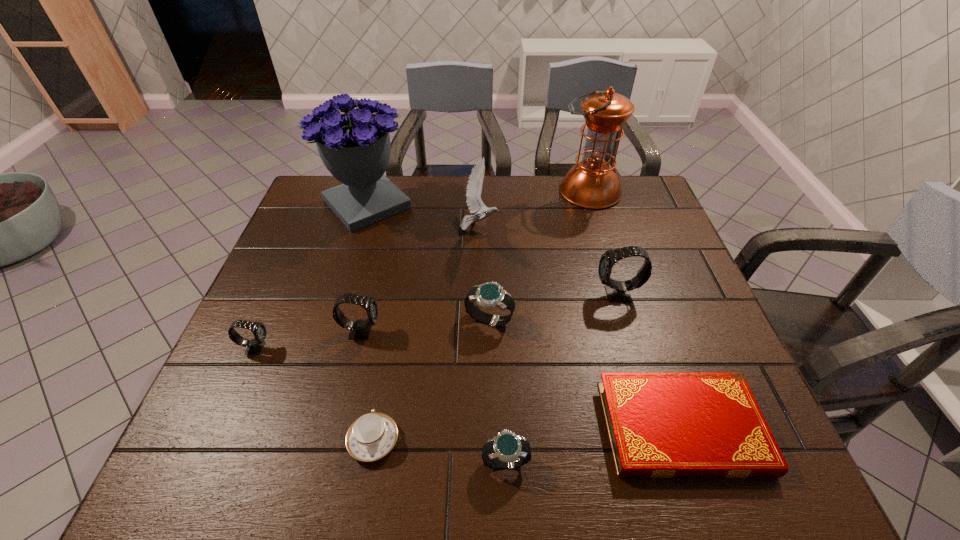
I want to click on watch that is positioned at the right edge, so tap(617, 291).

The image size is (960, 540). I want to click on hardback book at the right edge, so click(x=661, y=425).

At what (x,y) coordinates should I click in order to perform the action: click on object at the far left corner. Please return your answer as a coordinate pair (x, y). This screenshot has width=960, height=540. Looking at the image, I should click on (355, 147).

Image resolution: width=960 pixels, height=540 pixels. Find the location of `object at the far right corner`. object at the far right corner is located at coordinates (592, 183).

The height and width of the screenshot is (540, 960). What are the coordinates of `object situated at the near right corner` in the screenshot? It's located at (661, 425).

In the image, there is a desktop. Identify the location of free space at the far edge. (601, 218).

Locate an element on the screen. free space at the near edge of the desktop is located at coordinates (536, 445).

Where is `blank area at the left edge`? This screenshot has width=960, height=540. blank area at the left edge is located at coordinates (316, 300).

Locate an element on the screen. free spot at the right edge of the desktop is located at coordinates (693, 295).

You are a GUI agent. You are given a task and a screenshot of the screen. Output one action in this format:
    pyautogui.click(x=<x>, y=<y>)
    Task: Click on the free space at the near left corner
    This screenshot has width=960, height=540.
    Given the screenshot: What is the action you would take?
    tap(252, 460)